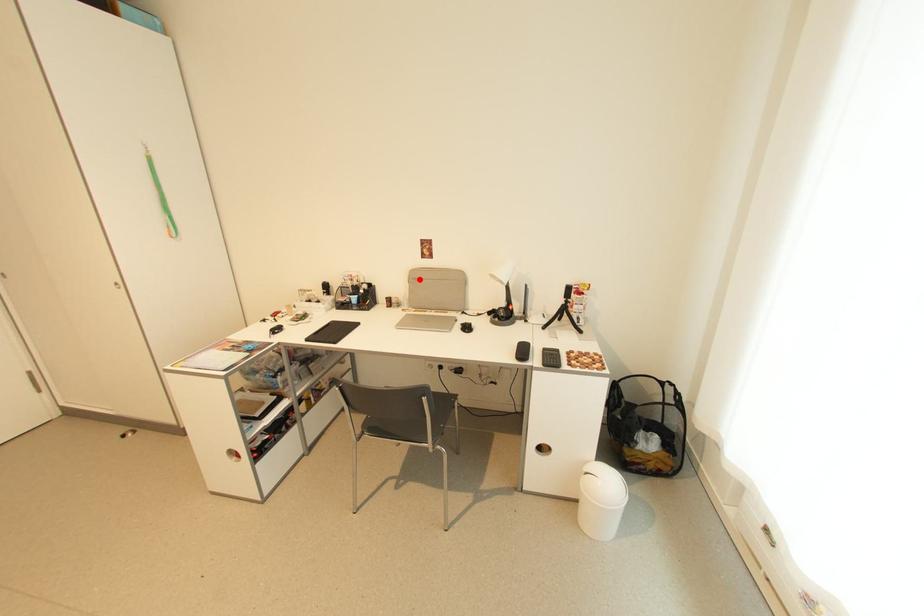
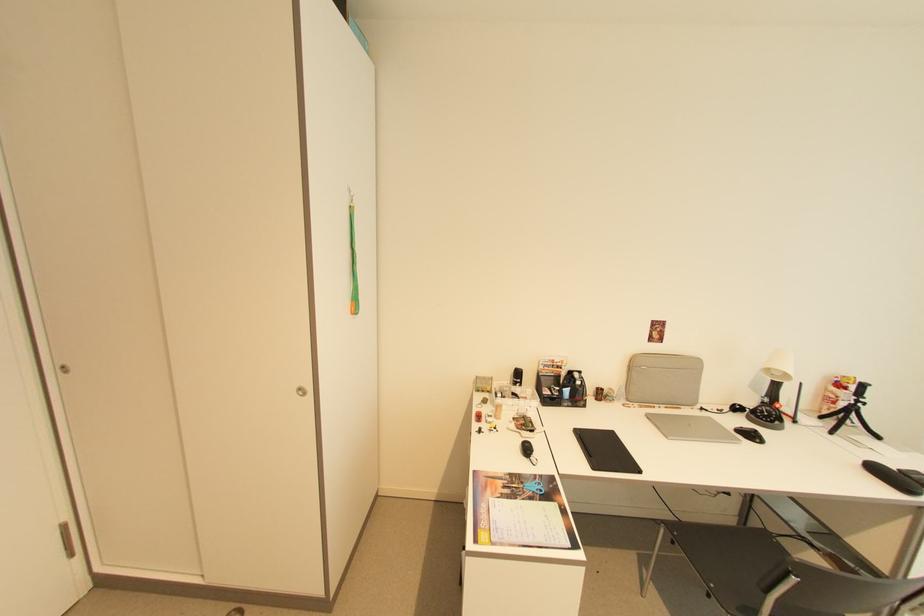
Find the pixel in the second image that matches the highlighted location in the first image.

(638, 366)